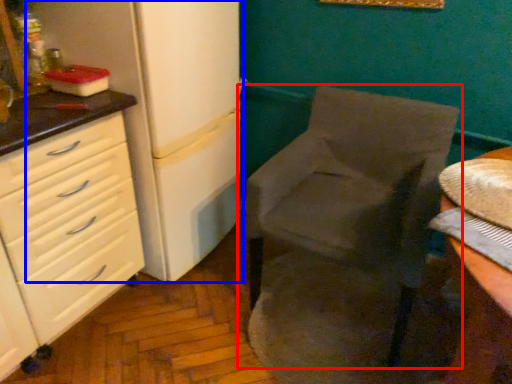
Question: Which object appears closest to the camera in this image, chair (highlighted by a red box) or refrigerator (highlighted by a blue box)?

Choices:
 (A) chair
 (B) refrigerator

Answer: (A)